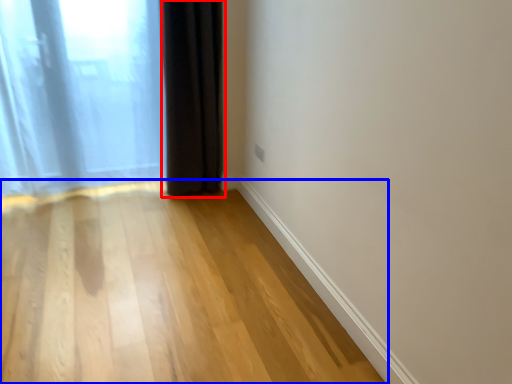
Question: Which point is further to the camera, curtain (highlighted by a red box) or corridor (highlighted by a blue box)?

Choices:
 (A) curtain
 (B) corridor

Answer: (A)